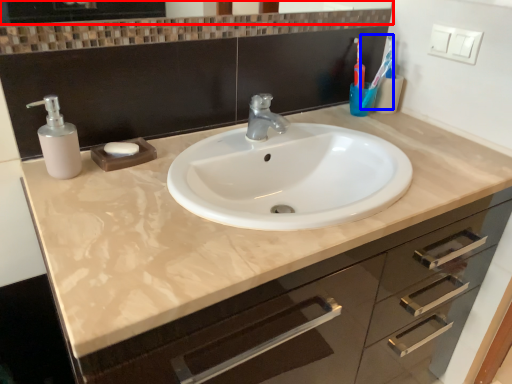
Question: Which object is further to the camera taking this photo, mirror (highlighted by a red box) or toothbrush (highlighted by a blue box)?

Choices:
 (A) mirror
 (B) toothbrush

Answer: (B)